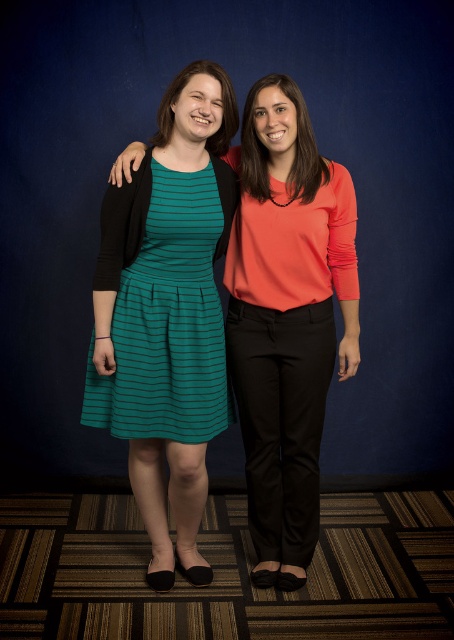
Is point (316, 365) in front of point (103, 388)?

No, it is not.

Between matte coral blouse at center and teal striped dress at center, which one appears on the left side from the viewer's perspective?

Positioned to the left is teal striped dress at center.

Where is `matte coral blouse at center`? The width and height of the screenshot is (454, 640). matte coral blouse at center is located at coordinates (286, 317).

I want to click on matte coral blouse at center, so click(286, 317).

Is teal striped dress at center taller than matte orange blouse at center?

Yes.

Is point (179, 214) farther from camera compared to point (260, 83)?

No, (179, 214) is in front of (260, 83).

Locate an element on the screen. The width and height of the screenshot is (454, 640). teal striped dress at center is located at coordinates (163, 305).

Is matte coral blouse at center below matte orange blouse at center?

Indeed, matte coral blouse at center is positioned under matte orange blouse at center.

Who is more distant from viewer, (241, 333) or (297, 138)?

Positioned behind is point (241, 333).

Does point (270, 412) come behind point (292, 193)?

Yes, point (270, 412) is behind point (292, 193).

At what (x,y) coordinates should I click in order to perform the action: click on matte coral blouse at center. Please return your answer as a coordinate pair (x, y). The height and width of the screenshot is (640, 454). Looking at the image, I should click on pos(286,317).